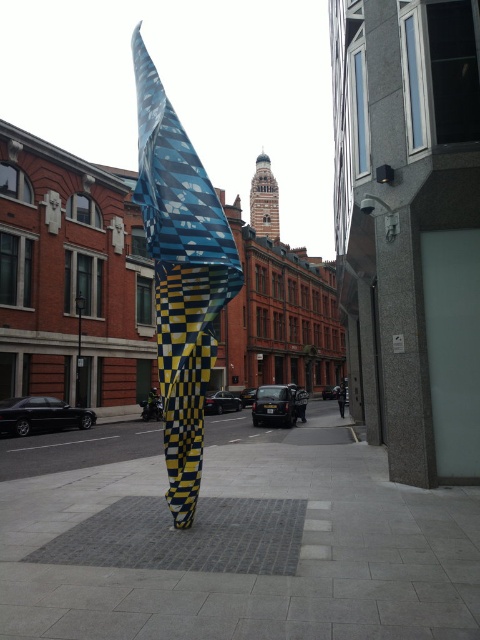
You are a delivery person trying to park your 2.5 meter wide truck. You see the gray concrete pavement at center and the blue and yellow checkered fabric at center. Which area is wider and can accommodate your truck?

The gray concrete pavement at center might be wider than blue and yellow checkered fabric at center, so it is more likely to accommodate your 2.5 meter wide truck.

You are a delivery person who needs to place a heavy box on the ground. You see the gray concrete pavement at center and the blue and yellow checkered fabric at center. Which surface is more suitable for placing the box?

The gray concrete pavement at center is positioned under the blue and yellow checkered fabric at center, so the gray concrete pavement at center is the solid surface and more suitable for placing the heavy box.